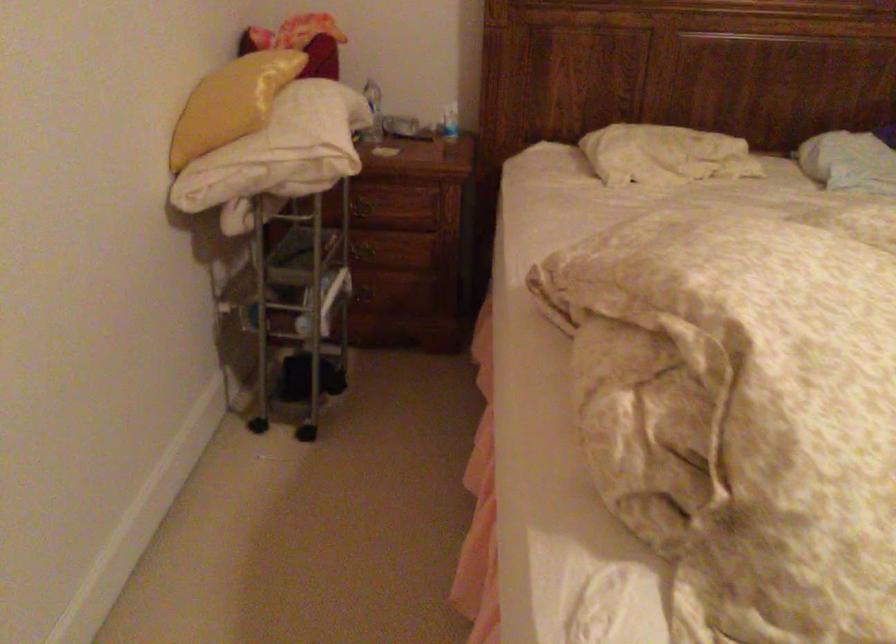
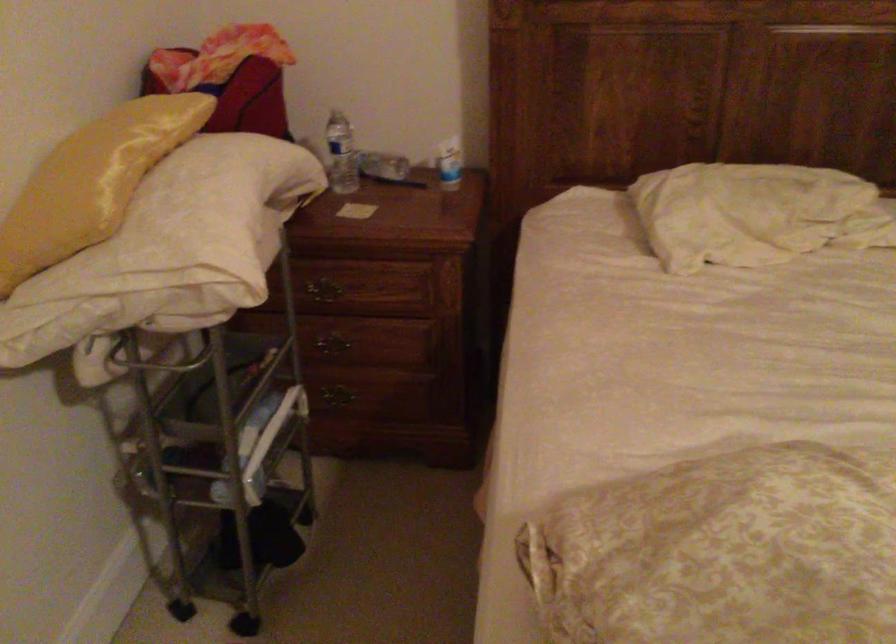
Question: The images are taken continuously from a first-person perspective. In which direction are you moving?

Choices:
 (A) Left
 (B) Right
 (C) Forward
 (D) Backward

Answer: (C)